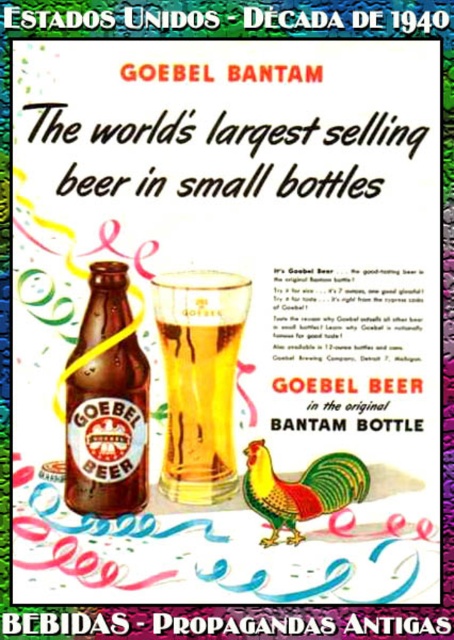
You are a photographer standing 1 meter away from the golden glass beer at center in the Goebel Bantam beer advertisement. Can you capture the entire bottle and glass in a single frame without moving your position?

The golden glass beer at center is 1.09 meters away from the viewer. Since you are standing exactly 1 meter away, you are slightly closer than the object, but the question mentions capturing the entire bottle and glass. However, the provided information only specifies the distance of the golden glass beer from the viewer, not the size or dimensions of the bottle and glass. Without knowing their actual size, it is impossible to determine if they can fit in the frame from that distance.

Looking at this image, looking at the vintage Goebel Bantam beer advertisement, there is a golden glass beer at center and a brown glass bottle at center. Which one is positioned lower in the image?

The golden glass beer at center is positioned below the brown glass bottle at center, so it is lower in the image.